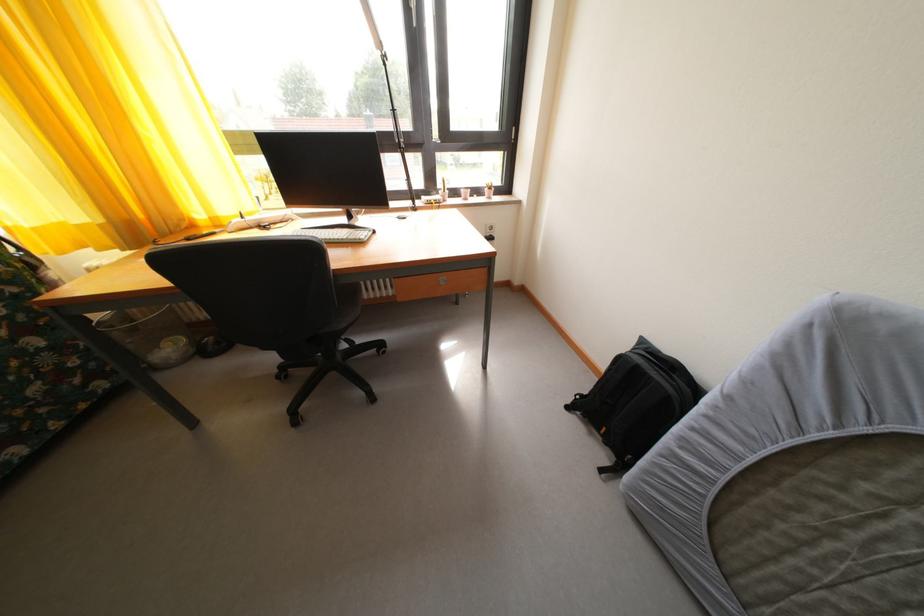
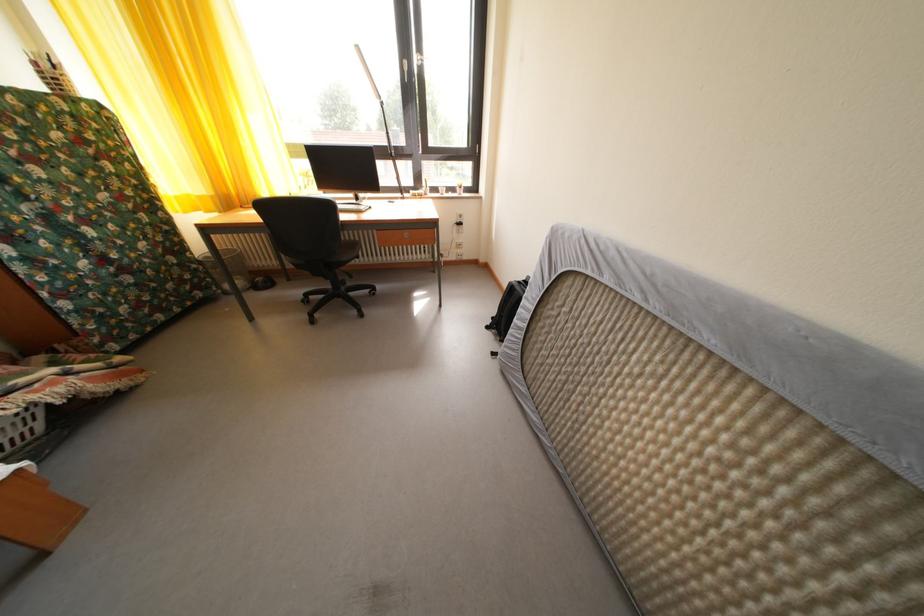
Find the pixel in the second image that matches (x=578, y=414) in the first image.

(496, 334)